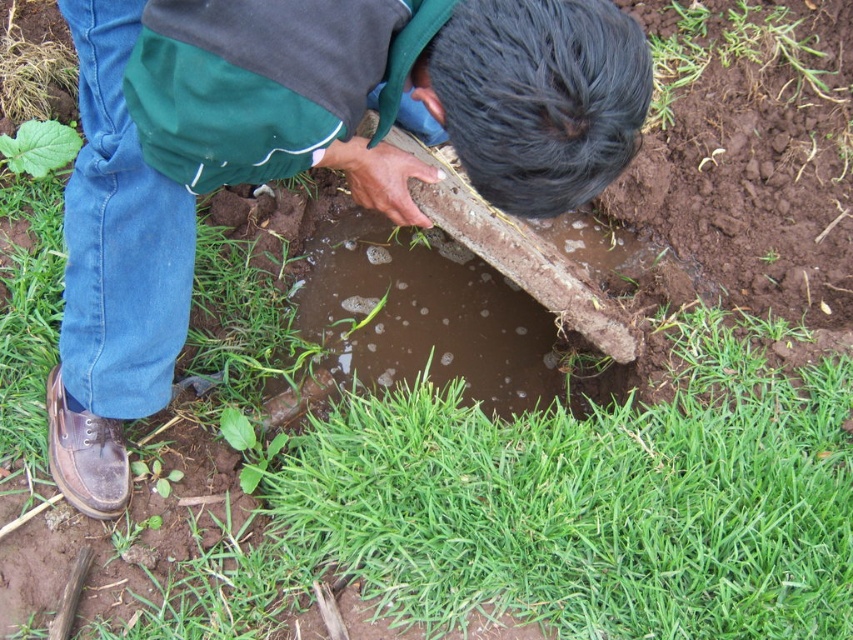
Which of these two, brown clay shovel at center or green grass at lower center, stands shorter?

With less height is green grass at lower center.

Who is higher up, brown clay shovel at center or green grass at lower center?

Positioned higher is brown clay shovel at center.

Who is more forward, (x=421, y=163) or (x=610, y=461)?

Point (x=421, y=163) is in front.

Where is `brown clay shovel at center`? This screenshot has width=853, height=640. brown clay shovel at center is located at coordinates (299, 154).